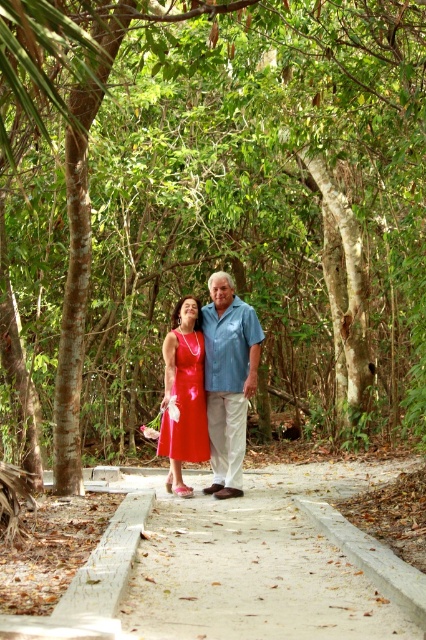
Question: Can you confirm if matte blue shirt at center is thinner than shiny satin dress at center?

Choices:
 (A) yes
 (B) no

Answer: (B)

Question: Which point is farther from the camera taking this photo?

Choices:
 (A) [x=253, y=394]
 (B) [x=166, y=456]

Answer: (B)

Question: Does matte blue shirt at center have a smaller size compared to shiny satin dress at center?

Choices:
 (A) yes
 (B) no

Answer: (B)

Question: Is matte blue shirt at center below shiny satin dress at center?

Choices:
 (A) no
 (B) yes

Answer: (A)

Question: Which point is farther to the camera?

Choices:
 (A) [x=215, y=458]
 (B) [x=187, y=426]

Answer: (A)

Question: Which point is farther to the camera?

Choices:
 (A) shiny satin dress at center
 (B) matte blue shirt at center

Answer: (A)